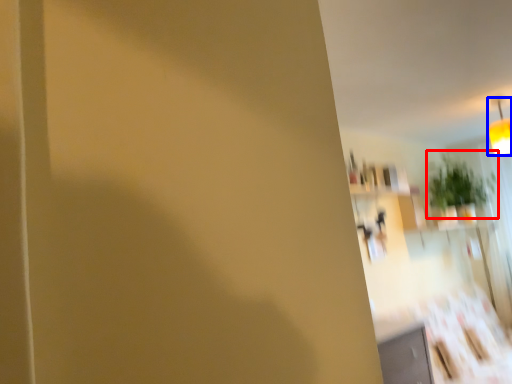
Question: Among these objects, which one is nearest to the camera, plant (highlighted by a red box) or light fixture (highlighted by a blue box)?

Choices:
 (A) plant
 (B) light fixture

Answer: (B)